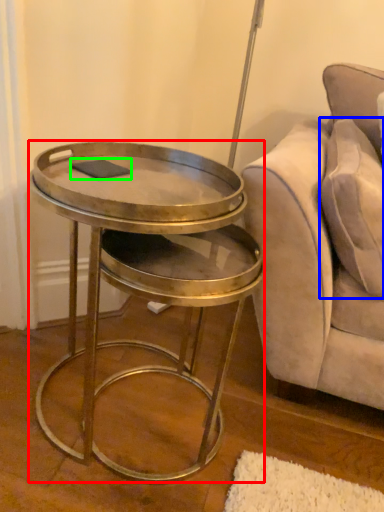
Question: Estimate the real-world distances between objects in this image. Which object is farther from table (highlighted by a red box), pillow (highlighted by a blue box) or pad (highlighted by a green box)?

Choices:
 (A) pillow
 (B) pad

Answer: (A)